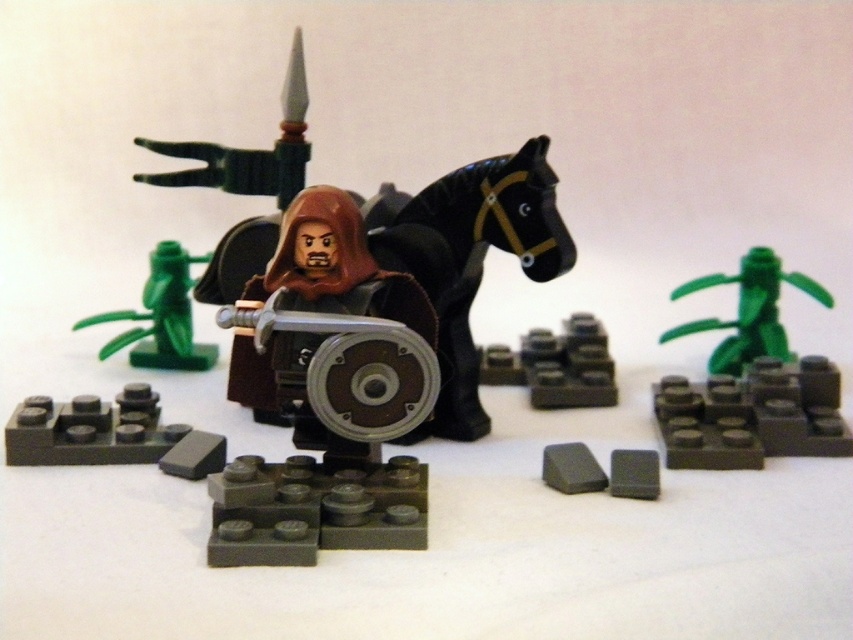
Is green plastic plant at lower left to the left of matte gray brick at lower right from the viewer's perspective?

Indeed, green plastic plant at lower left is positioned on the left side of matte gray brick at lower right.

Which of these two, green plastic plant at lower left or matte gray brick at lower right, stands taller?

With more height is green plastic plant at lower left.

Is point (206, 346) closer to camera compared to point (641, 480)?

No, it is not.

The width and height of the screenshot is (853, 640). What are the coordinates of `green plastic plant at lower left` in the screenshot? It's located at (161, 316).

Is brown matte minifigure at center bigger than green matte plant at center?

Yes, brown matte minifigure at center is bigger than green matte plant at center.

Between brown matte minifigure at center and green matte plant at center, which one has more height?

With more height is brown matte minifigure at center.

Which is in front, point (300, 356) or point (683, 292)?

Positioned in front is point (300, 356).

Identify the location of brown matte minifigure at center. (329, 330).

Who is shorter, brown matte minifigure at center or green plastic plant at lower left?

green plastic plant at lower left

Who is lower down, brown matte minifigure at center or green plastic plant at lower left?

brown matte minifigure at center is lower down.

Is point (361, 280) behind point (213, 358)?

No, it is in front of (213, 358).

Identify the location of brown matte minifigure at center. (329, 330).